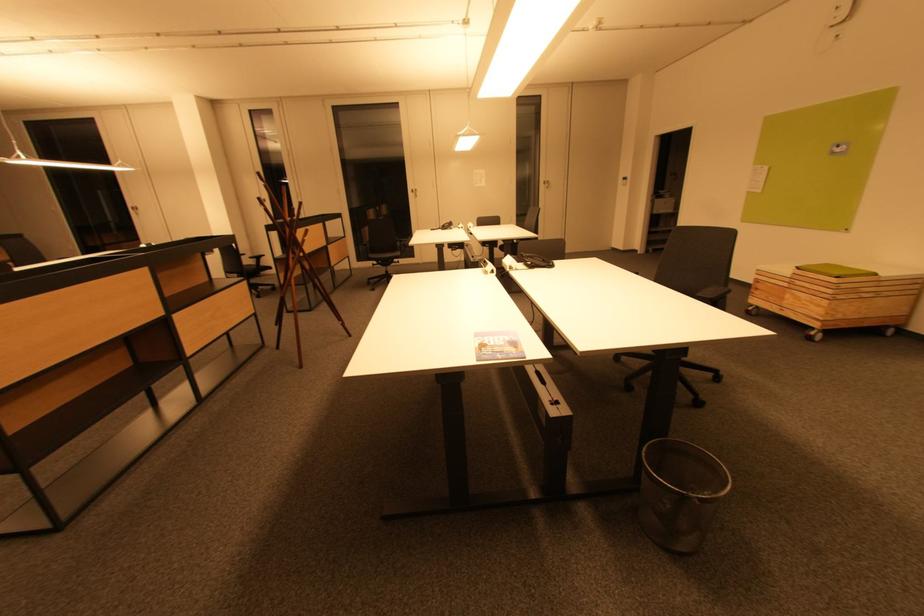
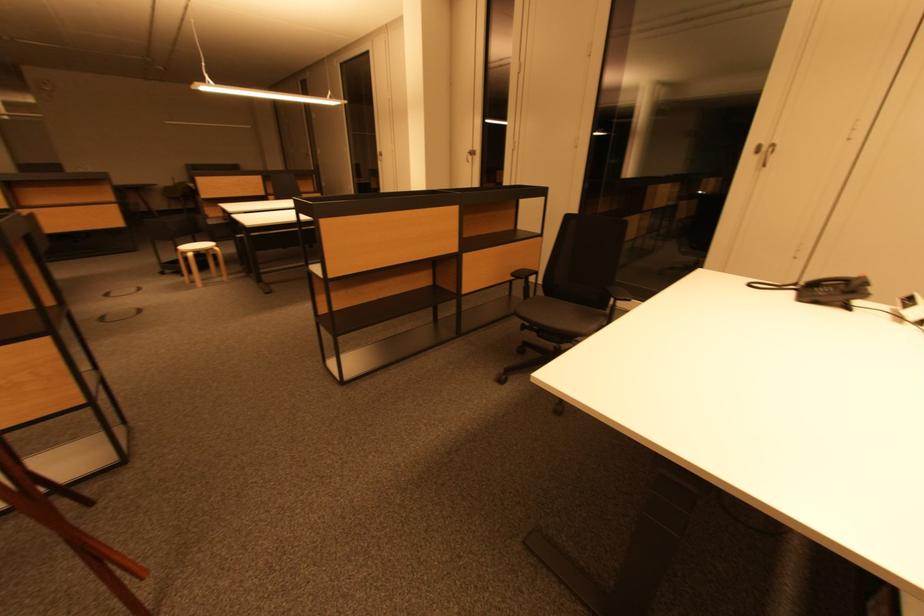
Where in the second image is the point corresponding to (334,249) from the first image?

(470, 259)